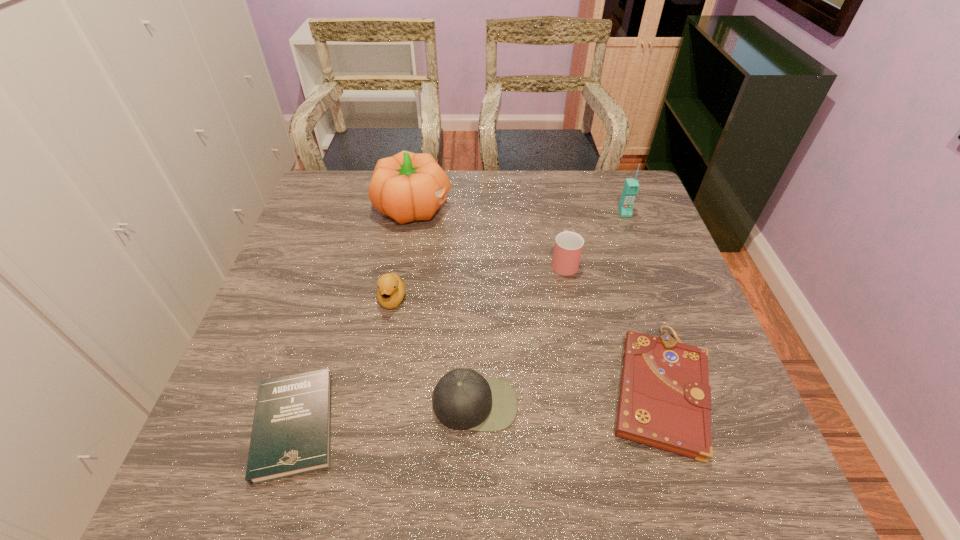
This screenshot has width=960, height=540. In order to click on free spot located on the side of the fifth nearest object with the handle in this screenshot , I will do `click(554, 209)`.

Find the location of `vacant space located on the side of the fifth nearest object with the handle`. vacant space located on the side of the fifth nearest object with the handle is located at coordinates coord(556,217).

Find the location of a particular element. The image size is (960, 540). free point located on the side of the fifth nearest object with the handle is located at coordinates (549, 181).

Where is `vacant space located on the brim of the cap`? This screenshot has width=960, height=540. vacant space located on the brim of the cap is located at coordinates (474, 486).

Identify the location of free space located 0.160m on the back of the sixth tallest object. (626, 280).

The height and width of the screenshot is (540, 960). Identify the location of vacant point located 0.100m on the back of the shortest object. click(x=322, y=338).

I want to click on pumpkin that is positioned at the far edge, so click(407, 186).

This screenshot has width=960, height=540. I want to click on cellular telephone at the far edge, so click(631, 186).

Locate an element on the screen. The height and width of the screenshot is (540, 960). notebook that is positioned at the near edge is located at coordinates (665, 399).

The image size is (960, 540). Find the location of `book that is at the near edge`. book that is at the near edge is located at coordinates (291, 435).